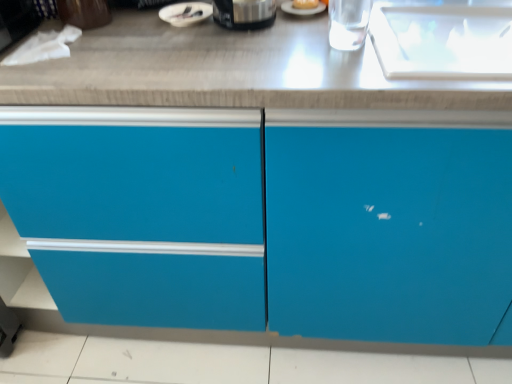
Question: Can you confirm if matte blue cabinet at center is thinner than white glossy bowl at upper center, placed as the 2th appliance when sorted from right to left?

Choices:
 (A) no
 (B) yes

Answer: (A)

Question: Considering the relative sizes of matte blue cabinet at center and white glossy bowl at upper center, marked as the 1th appliance in a left-to-right arrangement, in the image provided, is matte blue cabinet at center taller than white glossy bowl at upper center, marked as the 1th appliance in a left-to-right arrangement,?

Choices:
 (A) yes
 (B) no

Answer: (A)

Question: Does matte blue cabinet at center have a lesser height compared to white glossy bowl at upper center, placed as the 2th appliance when sorted from right to left?

Choices:
 (A) no
 (B) yes

Answer: (A)

Question: From the image's perspective, would you say matte blue cabinet at center is shown under white glossy bowl at upper center, placed as the 2th appliance when sorted from right to left?

Choices:
 (A) no
 (B) yes

Answer: (B)

Question: Does matte blue cabinet at center lie behind white glossy bowl at upper center, placed as the 2th appliance when sorted from right to left?

Choices:
 (A) yes
 (B) no

Answer: (B)

Question: From a real-world perspective, is matte blue cabinet at center positioned above or below golden bread at center?

Choices:
 (A) above
 (B) below

Answer: (B)

Question: In terms of size, does matte blue cabinet at center appear bigger or smaller than golden bread at center?

Choices:
 (A) big
 (B) small

Answer: (A)

Question: Is matte blue cabinet at center situated inside golden bread at center or outside?

Choices:
 (A) outside
 (B) inside

Answer: (A)

Question: Is matte blue cabinet at center in front of or behind golden bread at center in the image?

Choices:
 (A) behind
 (B) front

Answer: (B)

Question: In terms of height, does white glossy bowl at upper center, marked as the 1th appliance in a left-to-right arrangement, look taller or shorter compared to satin black coffee maker at upper center, the 2th appliance positioned from the left?

Choices:
 (A) short
 (B) tall

Answer: (A)

Question: Is white glossy bowl at upper center, placed as the 2th appliance when sorted from right to left, to the left or to the right of satin black coffee maker at upper center, the 1th appliance when ordered from right to left, in the image?

Choices:
 (A) left
 (B) right

Answer: (A)

Question: Relative to satin black coffee maker at upper center, the 2th appliance positioned from the left, is white glossy bowl at upper center, marked as the 1th appliance in a left-to-right arrangement, in front or behind?

Choices:
 (A) behind
 (B) front

Answer: (A)

Question: Considering the positions of point (172, 4) and point (272, 16), is point (172, 4) closer or farther from the camera than point (272, 16)?

Choices:
 (A) closer
 (B) farther

Answer: (B)

Question: Relative to matte blue cabinet at center, is golden bread at center in front or behind?

Choices:
 (A) behind
 (B) front

Answer: (A)

Question: Is golden bread at center bigger or smaller than matte blue cabinet at center?

Choices:
 (A) small
 (B) big

Answer: (A)